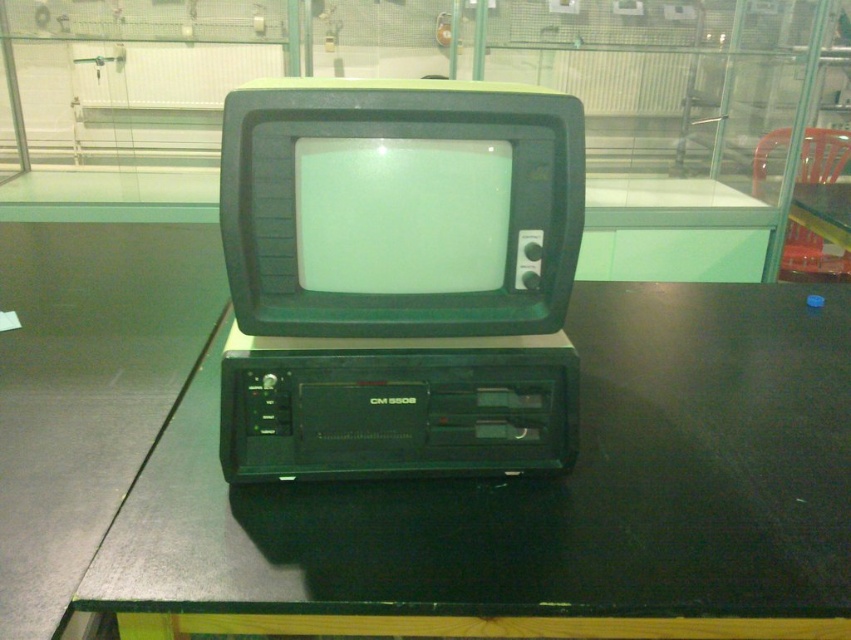
You are setting up a desk area and need to place both the black glossy table at center and the green matte crt monitor at center. Given their sizes, which one should be placed on top of the other?

The black glossy table at center is much taller than the green matte crt monitor at center, so it should be placed on top of the monitor to maintain stability and proper arrangement.

You are standing in front of an old television set and need to locate two specific points marked on the image. The first point is at coordinates point (340,630) and the second is at point (288,248). Which of these points is closer to you?

Point (340,630) is in front of point (288,248), so it is closer to you.

You are standing in front of the scene and want to place a small object on the black glossy table at center. Can you confirm the exact coordinates where you should place it?

The exact coordinates for the black glossy table at center are point (x=541, y=499), so place the small object there.